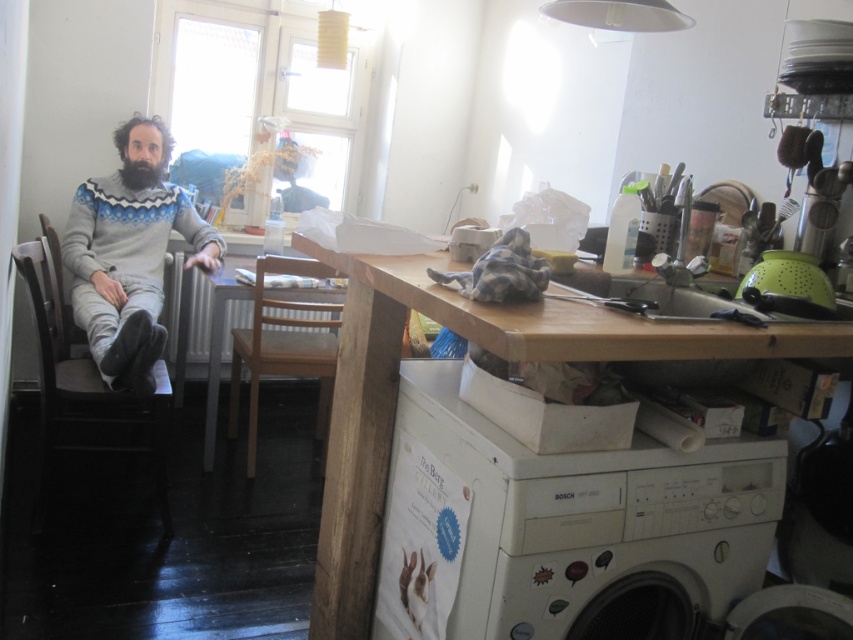
Question: Can you confirm if gray fabric chair at left is smaller than wooden chair at center?

Choices:
 (A) yes
 (B) no

Answer: (B)

Question: Is gray fabric chair at left thinner than wooden chair at center?

Choices:
 (A) no
 (B) yes

Answer: (A)

Question: Which object appears farthest from the camera in this image?

Choices:
 (A) knitted sweater at left
 (B) gray fabric chair at left
 (C) white plastic washing machine at lower right

Answer: (A)

Question: Which of the following is the farthest from the observer?

Choices:
 (A) knitted sweater at left
 (B) white plastic washing machine at lower right
 (C) wooden chair at center

Answer: (C)

Question: Does white plastic washing machine at lower right have a smaller size compared to gray fabric chair at left?

Choices:
 (A) no
 (B) yes

Answer: (B)

Question: Estimate the real-world distances between objects in this image. Which object is closer to the gray fabric chair at left?

Choices:
 (A) wooden chair at center
 (B) knitted sweater at left

Answer: (B)